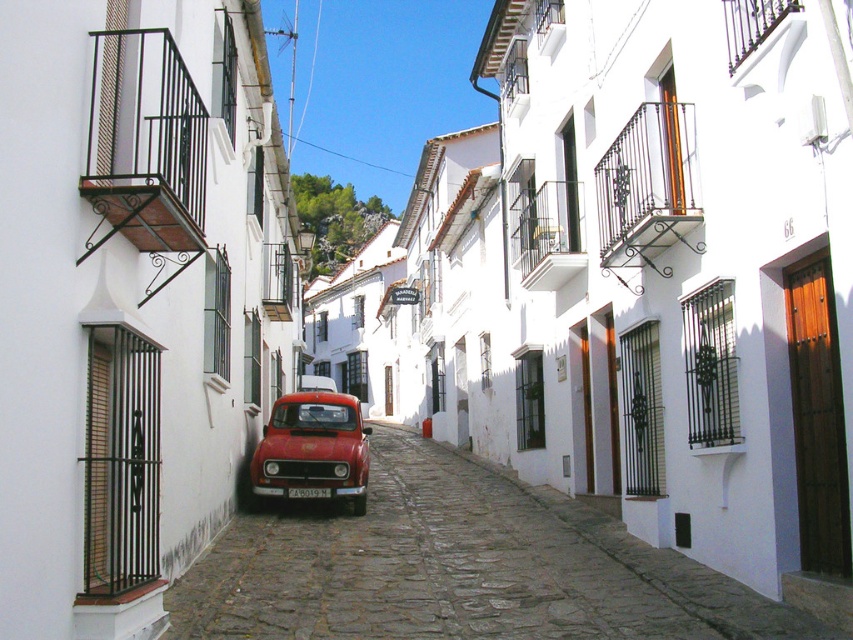
You are standing at the entrance of the street and want to take a photo of the metallic red car at center without including any of the white buildings. Is the position at point (457, 566) suitable for this purpose?

The metallic red car at center is located at point (457, 566), so yes, positioning yourself there would allow you to capture the car without any buildings in the frame.

You are a photographer planning to take a picture of the matte red car at center and the white plastic license plate at center in the Mediterranean street scene. Since you want to emphasize the car, which object should you focus on to ensure the car appears sharp and in focus?

You should focus on the matte red car at center because it is larger in size compared to the white plastic license plate at center, making it easier to capture in sharp focus.

You are a photographer aiming to capture the entire metallic red car at center and white plastic license plate at center in one frame. Given that the license plate must be clearly visible, would adjusting the camera angle upwards help achieve this?

The metallic red car at center is taller than the white plastic license plate at center. By tilting the camera upwards, the photographer can ensure both the metallic red car at center and the white plastic license plate at center are fully visible while keeping the license plate in clear focus.